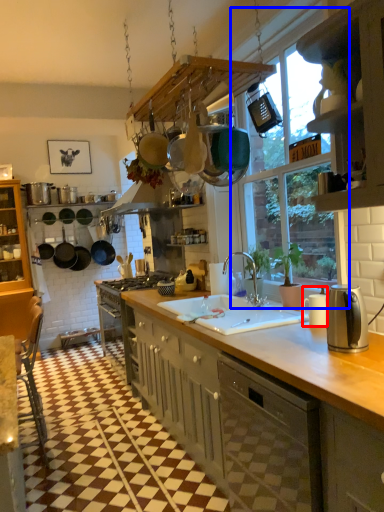
Question: Which point is further to the camera, appliance (highlighted by a red box) or window (highlighted by a blue box)?

Choices:
 (A) appliance
 (B) window

Answer: (A)